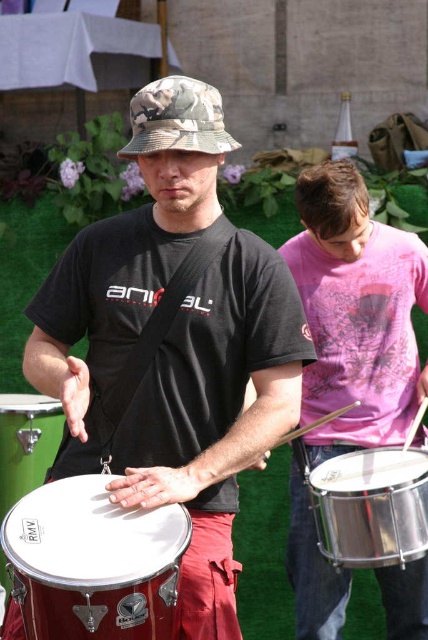
Question: Is matte black drum at center above pink cotton shirt at right?

Choices:
 (A) no
 (B) yes

Answer: (B)

Question: Which point appears closest to the camera in this image?

Choices:
 (A) (365, 460)
 (B) (318, 259)

Answer: (A)

Question: Is matte black drum at center bigger than metallic red drum at center?

Choices:
 (A) yes
 (B) no

Answer: (A)

Question: Is matte black drum at center bigger than shiny metallic drum at center?

Choices:
 (A) yes
 (B) no

Answer: (A)

Question: Which of the following is the closest to the observer?

Choices:
 (A) matte black drum at center
 (B) pink cotton shirt at right

Answer: (A)

Question: Which point appears farthest from the camera in this image?

Choices:
 (A) pyautogui.click(x=415, y=340)
 (B) pyautogui.click(x=392, y=547)

Answer: (A)